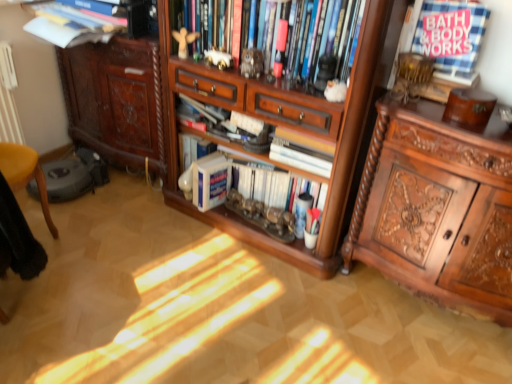
Where is `vacant space to the left of wooden cabinet at center`? vacant space to the left of wooden cabinet at center is located at coordinates (130, 239).